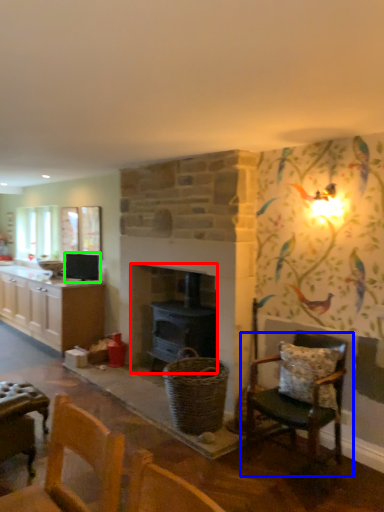
Question: Which object is positioned closest to fireplace (highlighted by a red box)? Select from chair (highlighted by a blue box) and appliance (highlighted by a green box).

Choices:
 (A) chair
 (B) appliance

Answer: (A)